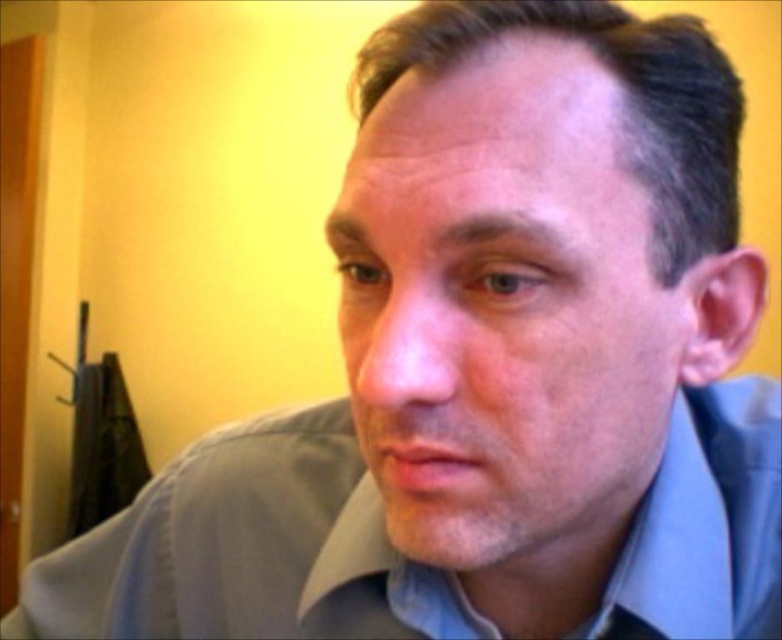
Question: Which point is farther from the camera taking this photo?

Choices:
 (A) (622, 568)
 (B) (368, 253)

Answer: (A)

Question: Is smooth skin face at center to the right of light blue cotton dress shirt at center from the viewer's perspective?

Choices:
 (A) yes
 (B) no

Answer: (A)

Question: Which point appears farthest from the camera in this image?

Choices:
 (A) (601, 536)
 (B) (698, 573)

Answer: (A)

Question: Which point is farther to the camera?

Choices:
 (A) (465, 568)
 (B) (206, 452)

Answer: (B)

Question: Does smooth skin face at center have a smaller size compared to light blue cotton dress shirt at center?

Choices:
 (A) no
 (B) yes

Answer: (B)

Question: Does smooth skin face at center have a greater width compared to light blue cotton dress shirt at center?

Choices:
 (A) no
 (B) yes

Answer: (A)